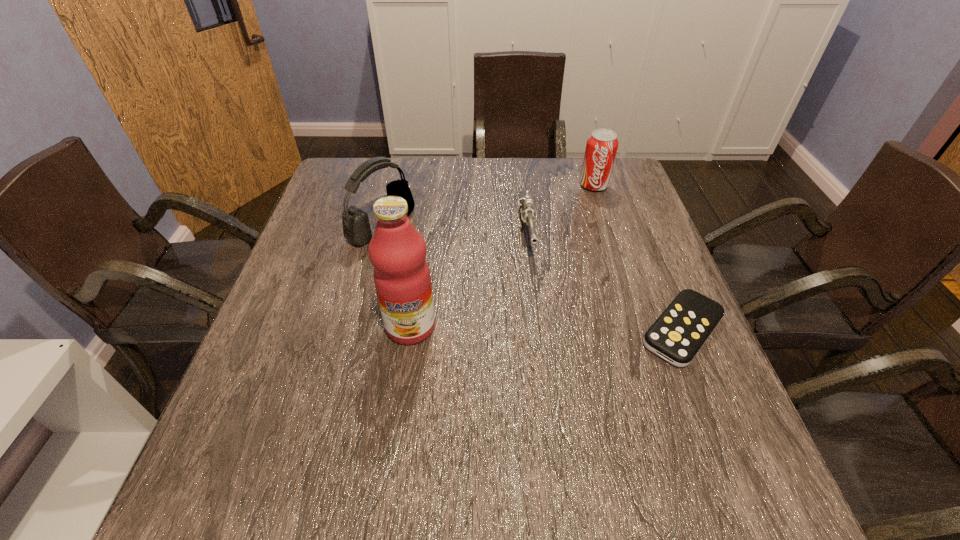
Where is `free space between the shortest object and the second shortest object`? The width and height of the screenshot is (960, 540). free space between the shortest object and the second shortest object is located at coordinates (605, 281).

Where is `free space between the fruit juice and the third object from left to right`? This screenshot has height=540, width=960. free space between the fruit juice and the third object from left to right is located at coordinates (468, 279).

Where is `vacant space in between the soda can and the fourth shortest object`? vacant space in between the soda can and the fourth shortest object is located at coordinates (488, 206).

Identify the location of vacant area between the remote control and the gun. (605, 281).

In order to click on free spot between the third shortest object and the headset in this screenshot , I will do `click(488, 206)`.

Identify the location of free point between the fruit juice and the third shortest object. (502, 256).

Where is `free space between the tallest object and the shortest object`? The image size is (960, 540). free space between the tallest object and the shortest object is located at coordinates (546, 328).

Image resolution: width=960 pixels, height=540 pixels. In order to click on free spot between the third object from right to left and the remote control in this screenshot , I will do (605, 281).

Locate which object ranks second in proximity to the fruit juice. Please provide its 2D coordinates. Your answer should be formatted as a tuple, i.e. [(x, y)], where the tuple contains the x and y coordinates of a point satisfying the conditions above.

[(525, 206)]

Find the location of a particular element. the third closest object to the remote control is located at coordinates (397, 251).